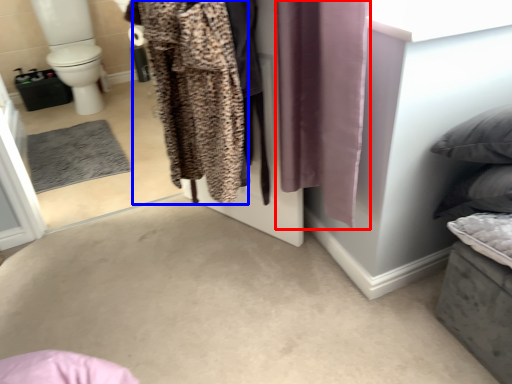
Question: Which object is further to the camera taking this photo, curtain (highlighted by a red box) or clothing (highlighted by a blue box)?

Choices:
 (A) curtain
 (B) clothing

Answer: (B)